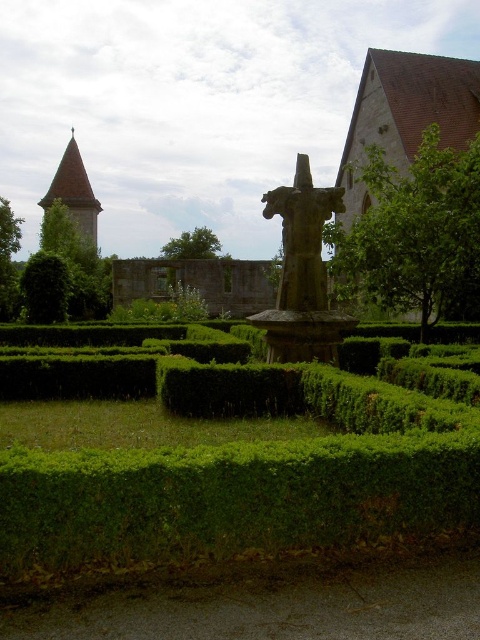
Question: Which point appears closest to the camera in this image?

Choices:
 (A) (386, 531)
 (B) (387, 301)
 (C) (291, 333)
 (D) (55, 314)

Answer: (A)

Question: Does green leafy hedge at center have a lesser width compared to stone statue at center?

Choices:
 (A) no
 (B) yes

Answer: (A)

Question: Does green leafy hedge at center lie in front of green leafy tree at left?

Choices:
 (A) no
 (B) yes

Answer: (B)

Question: Based on their relative distances, which object is nearer to the green leafy tree at left?

Choices:
 (A) smooth stone tower at upper left
 (B) green leafy tree at center

Answer: (A)

Question: Which of these objects is positioned closest to the green leafy tree at center?

Choices:
 (A) green leafy bush at left
 (B) green leafy tree at upper right

Answer: (A)

Question: Does stone statue at center have a larger size compared to green leafy tree at center?

Choices:
 (A) yes
 (B) no

Answer: (B)